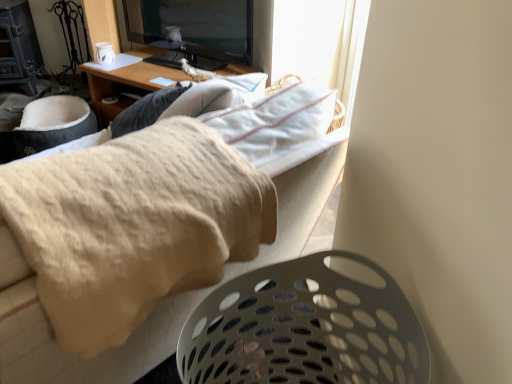
Question: Is wooden desk at upper center bigger than white perforated laundry basket at lower right?

Choices:
 (A) no
 (B) yes

Answer: (B)

Question: Considering the relative sizes of wooden desk at upper center and white perforated laundry basket at lower right in the image provided, is wooden desk at upper center wider than white perforated laundry basket at lower right?

Choices:
 (A) no
 (B) yes

Answer: (B)

Question: Can you see wooden desk at upper center touching white perforated laundry basket at lower right?

Choices:
 (A) yes
 (B) no

Answer: (B)

Question: Is wooden desk at upper center facing away from white perforated laundry basket at lower right?

Choices:
 (A) yes
 (B) no

Answer: (B)

Question: Considering the relative positions of wooden desk at upper center and white perforated laundry basket at lower right in the image provided, is wooden desk at upper center to the right of white perforated laundry basket at lower right from the viewer's perspective?

Choices:
 (A) yes
 (B) no

Answer: (B)

Question: In the image, is white perforated laundry basket at lower right on the left side or the right side of wooden desk at upper center?

Choices:
 (A) right
 (B) left

Answer: (A)

Question: Relative to wooden desk at upper center, is white perforated laundry basket at lower right in front or behind?

Choices:
 (A) behind
 (B) front

Answer: (B)

Question: From the image's perspective, is white perforated laundry basket at lower right positioned above or below wooden desk at upper center?

Choices:
 (A) below
 (B) above

Answer: (A)

Question: Is white perforated laundry basket at lower right bigger or smaller than wooden desk at upper center?

Choices:
 (A) big
 (B) small

Answer: (B)

Question: Considering their positions, is white perforated laundry basket at lower right located in front of or behind beige fabric couch at upper center?

Choices:
 (A) front
 (B) behind

Answer: (B)

Question: From the image's perspective, is white perforated laundry basket at lower right located above or below beige fabric couch at upper center?

Choices:
 (A) above
 (B) below

Answer: (B)

Question: Considering the positions of white perforated laundry basket at lower right and beige fabric couch at upper center in the image, is white perforated laundry basket at lower right bigger or smaller than beige fabric couch at upper center?

Choices:
 (A) big
 (B) small

Answer: (B)

Question: Considering the positions of point (287, 281) and point (284, 196), is point (287, 281) closer or farther from the camera than point (284, 196)?

Choices:
 (A) farther
 (B) closer

Answer: (B)

Question: Is wooden desk at upper center situated inside white perforated laundry basket at lower right or outside?

Choices:
 (A) outside
 (B) inside

Answer: (A)

Question: In the image, is wooden desk at upper center positioned in front of or behind white perforated laundry basket at lower right?

Choices:
 (A) behind
 (B) front

Answer: (A)